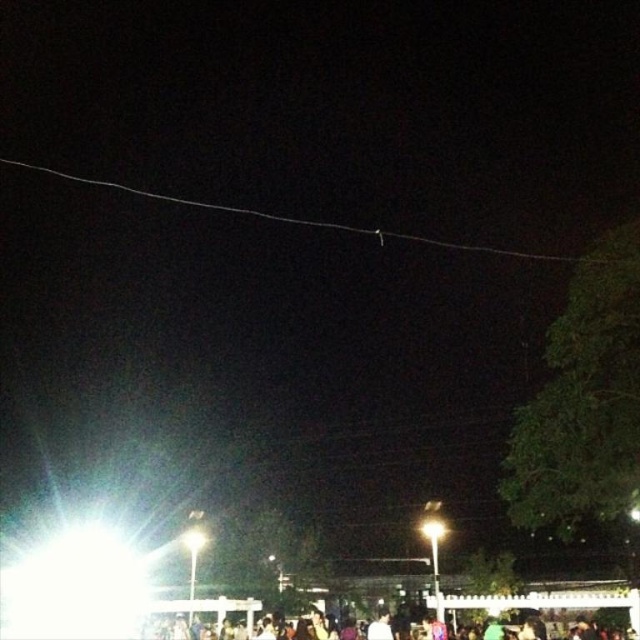
Between white wire at upper center and dark clothing crowd at lower center, which one is positioned higher?

Positioned higher is white wire at upper center.

Can you confirm if white wire at upper center is positioned above dark clothing crowd at lower center?

Yes.

This screenshot has width=640, height=640. I want to click on white wire at upper center, so click(x=321, y=221).